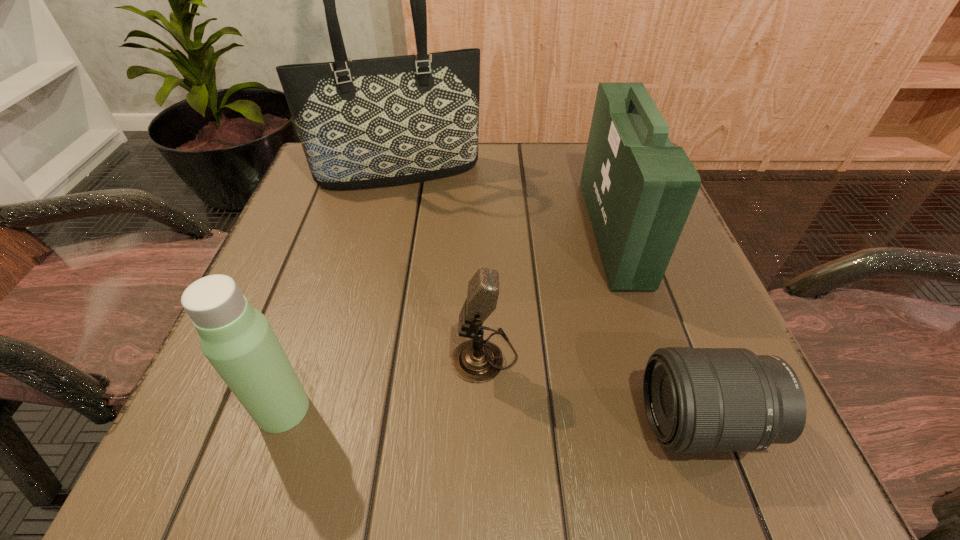
The height and width of the screenshot is (540, 960). I want to click on vacant area that lies between the thermos bottle and the first-aid kit, so pos(448,320).

Locate an element on the screen. The height and width of the screenshot is (540, 960). empty space that is in between the fourth tallest object and the first-aid kit is located at coordinates (549, 293).

The width and height of the screenshot is (960, 540). I want to click on free space between the second shortest object and the tallest object, so click(x=442, y=264).

The width and height of the screenshot is (960, 540). I want to click on the fourth closest object to the thermos bottle, so click(639, 189).

I want to click on object identified as the fourth closest to the first-aid kit, so click(237, 339).

Find the location of a particular element. The height and width of the screenshot is (540, 960). free space that satisfies the following two spatial constraints: 1. on the front-facing side of the microphone; 2. on the front side of the thermos bottle is located at coordinates (486, 409).

Find the location of a particular element. The height and width of the screenshot is (540, 960). vacant space that satisfies the following two spatial constraints: 1. on the front-facing side of the first-aid kit; 2. on the front side of the thermos bottle is located at coordinates (671, 409).